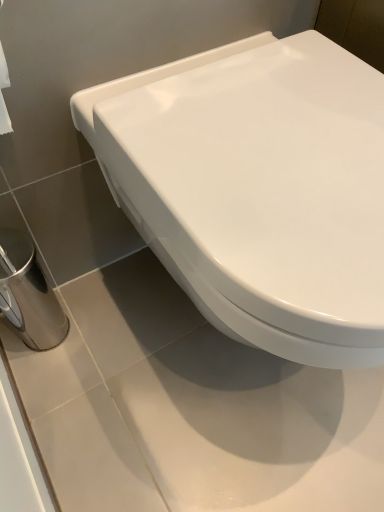
This screenshot has height=512, width=384. What do you see at coordinates (258, 189) in the screenshot?
I see `white glossy toilet at center` at bounding box center [258, 189].

Where is `white glossy toilet at center`? The height and width of the screenshot is (512, 384). white glossy toilet at center is located at coordinates (258, 189).

Identify the location of white glossy toilet at center. (258, 189).